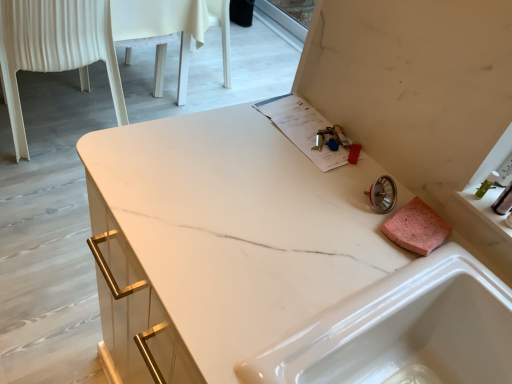
Question: Can you confirm if translucent plastic container at right is smaller than white plastic chair at left?

Choices:
 (A) yes
 (B) no

Answer: (A)

Question: Is translucent plastic container at right not within white plastic chair at left?

Choices:
 (A) yes
 (B) no

Answer: (A)

Question: Would you say white plastic chair at left is part of translucent plastic container at right's contents?

Choices:
 (A) no
 (B) yes

Answer: (A)

Question: Can you confirm if translucent plastic container at right is shorter than white plastic chair at left?

Choices:
 (A) no
 (B) yes

Answer: (B)

Question: Is translucent plastic container at right directly adjacent to white plastic chair at left?

Choices:
 (A) no
 (B) yes

Answer: (A)

Question: Is point (504, 193) positioned closer to the camera than point (53, 1)?

Choices:
 (A) farther
 (B) closer

Answer: (B)

Question: Considering their positions, is translucent plastic container at right located in front of or behind white plastic chair at left?

Choices:
 (A) front
 (B) behind

Answer: (A)

Question: From a real-world perspective, relative to white plastic chair at left, is translucent plastic container at right vertically above or below?

Choices:
 (A) above
 (B) below

Answer: (A)

Question: In terms of size, does translucent plastic container at right appear bigger or smaller than white plastic chair at left?

Choices:
 (A) small
 (B) big

Answer: (A)

Question: Considering the positions of point (33, 69) and point (431, 281), is point (33, 69) closer or farther from the camera than point (431, 281)?

Choices:
 (A) farther
 (B) closer

Answer: (A)

Question: In terms of height, does white plastic chair at left look taller or shorter compared to white glossy sink at lower right?

Choices:
 (A) tall
 (B) short

Answer: (A)

Question: Is white plastic chair at left inside or outside of white glossy sink at lower right?

Choices:
 (A) outside
 (B) inside

Answer: (A)

Question: From the image's perspective, relative to white glossy sink at lower right, is white plastic chair at left above or below?

Choices:
 (A) above
 (B) below

Answer: (A)

Question: Looking at the image, does translucent plastic container at right seem bigger or smaller compared to white glossy sink at lower right?

Choices:
 (A) big
 (B) small

Answer: (B)

Question: In the image, is translucent plastic container at right on the left side or the right side of white glossy sink at lower right?

Choices:
 (A) left
 (B) right

Answer: (B)